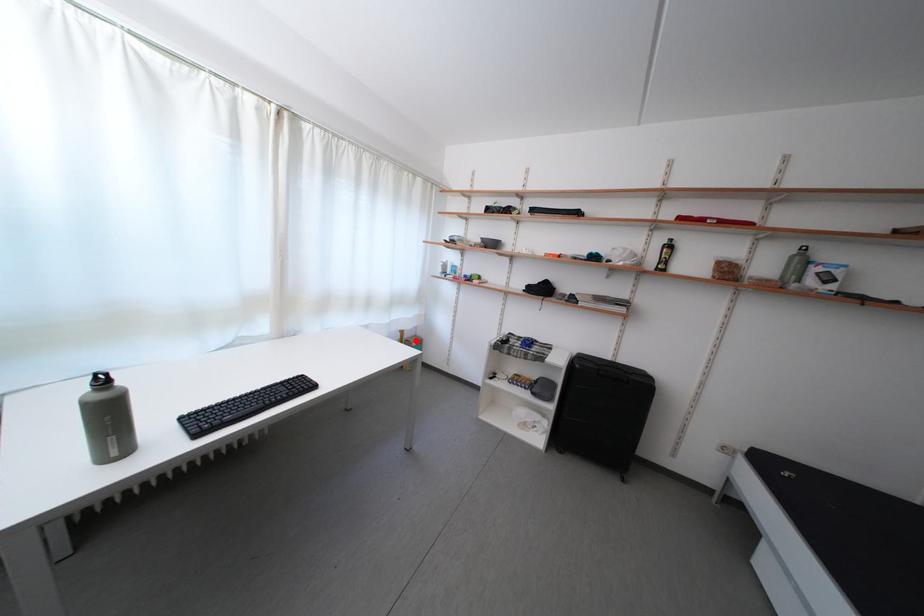
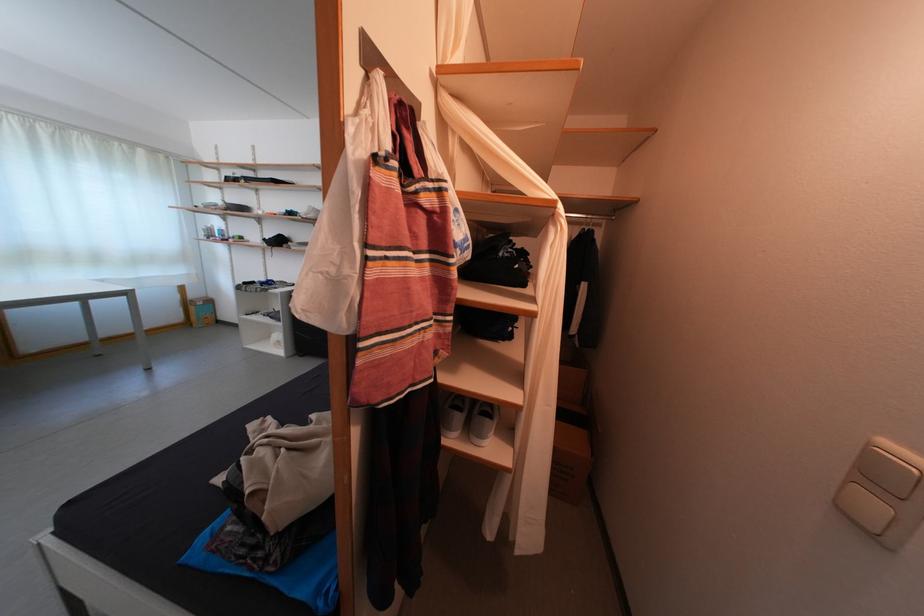
Find the pixel in the second image that matches the highlighted location in the first image.

(201, 302)